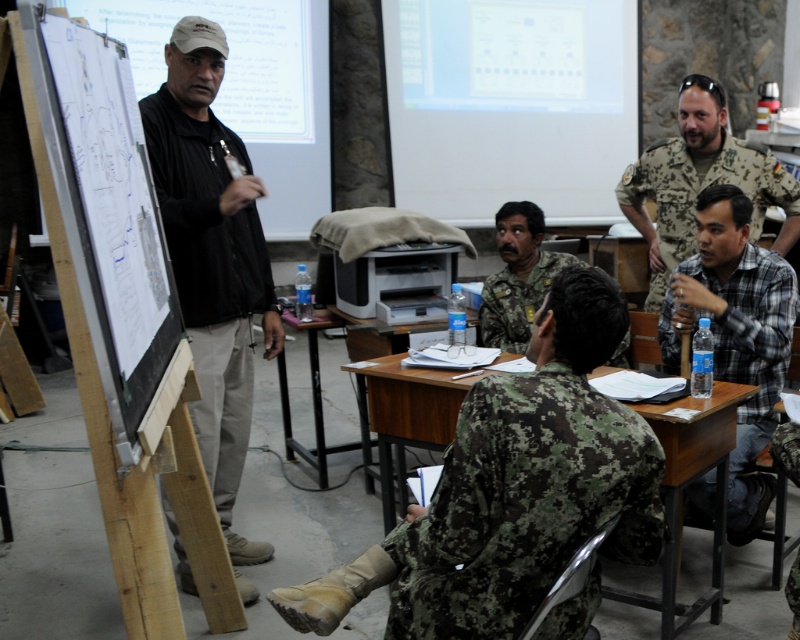
Based on the photo, does camouflage fabric shirt at right have a larger size compared to camouflage uniform at center?

Indeed, camouflage fabric shirt at right has a larger size compared to camouflage uniform at center.

Is point (682, 227) positioned after point (524, 241)?

Yes, point (682, 227) is behind point (524, 241).

Find the location of a particular element. camouflage fabric shirt at right is located at coordinates (698, 193).

Does black matte jacket at left appear under wooden desk at lower center?

No.

Which is behind, point (164, 125) or point (680, 413)?

The point (164, 125) is more distant.

Locate an element on the screen. This screenshot has width=800, height=640. black matte jacket at left is located at coordinates (212, 257).

Which of these two, whiteboard at left or black matte jacket at left, stands shorter?

whiteboard at left

Does whiteboard at left have a greater height compared to black matte jacket at left?

No, whiteboard at left is not taller than black matte jacket at left.

Find the location of a particular element. Image resolution: width=800 pixels, height=640 pixels. whiteboard at left is located at coordinates (120, 320).

Where is `whiteboard at left`? The image size is (800, 640). whiteboard at left is located at coordinates (120, 320).